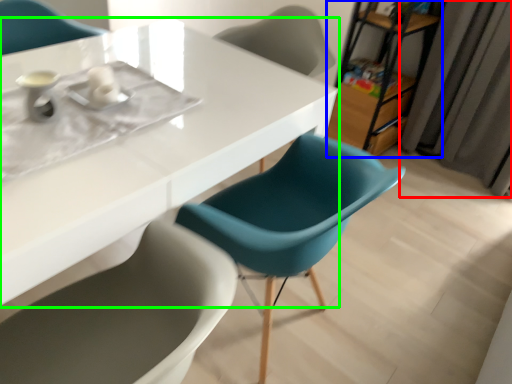
Question: Estimate the real-world distances between objects in this image. Which object is closer to curtain (highlighted by a red box), bookshelf (highlighted by a blue box) or table (highlighted by a green box)?

Choices:
 (A) bookshelf
 (B) table

Answer: (A)